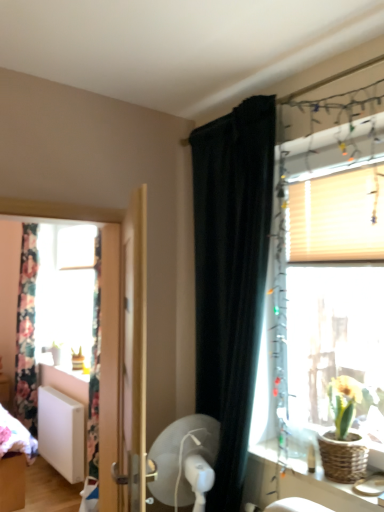
Find the location of a particular element. vacant region under white matte radiator at lower left (from a real-world perspective) is located at coordinates (55, 479).